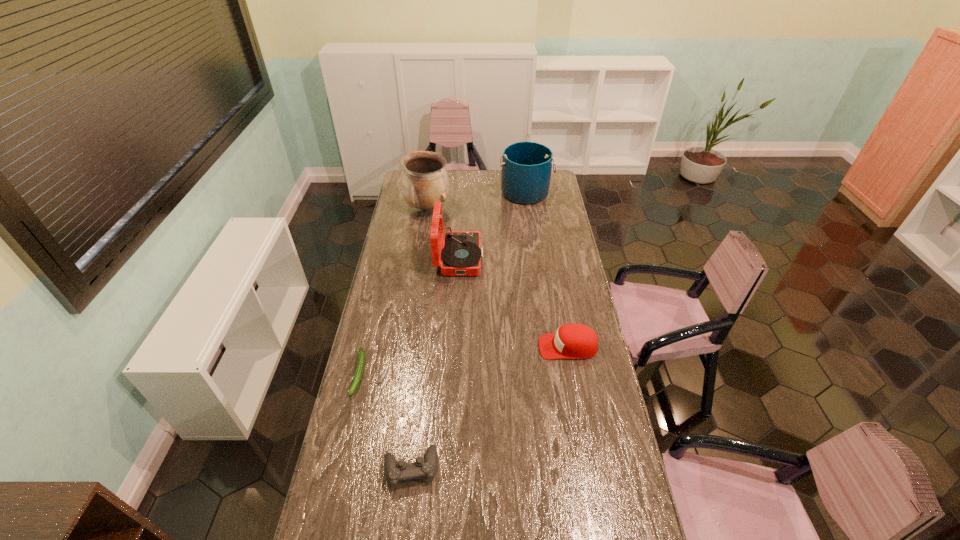
Locate an element on the screen. The height and width of the screenshot is (540, 960). vacant space that satisfies the following two spatial constraints: 1. on the front-facing side of the fifth tallest object; 2. on the right side of the zucchini is located at coordinates (336, 468).